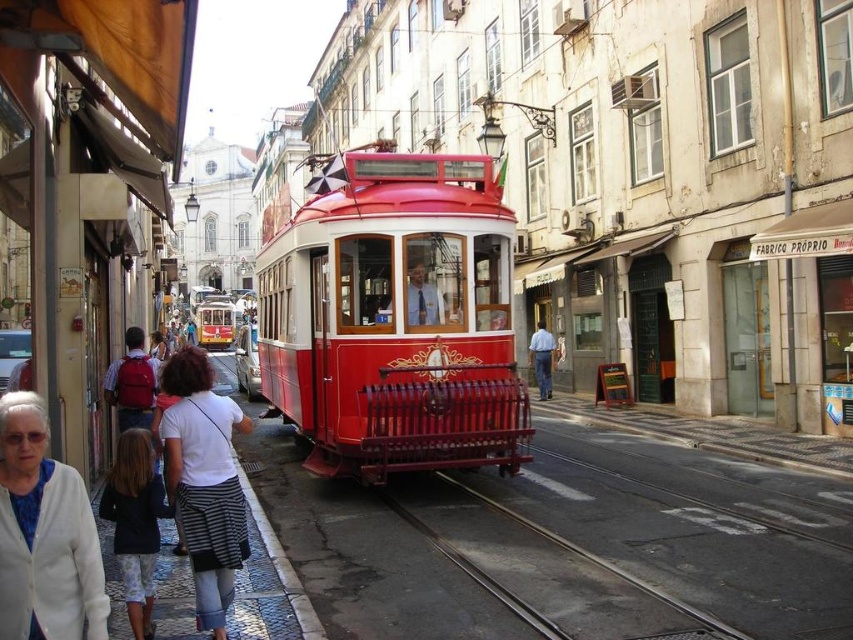
Can you confirm if shiny red tram at center is smaller than white fabric jacket at lower left?

No.

Is point (456, 276) behind point (59, 564)?

That is True.

Is point (343, 364) positioned behind point (32, 614)?

Yes, point (343, 364) is behind point (32, 614).

I want to click on shiny red tram at center, so click(x=393, y=317).

Does point (311, 376) come farther from viewer compared to point (132, 634)?

Yes, point (311, 376) is behind point (132, 634).

Is shiny red tram at center closer to camera compared to dark blue shirt at lower left?

That is False.

Between point (345, 211) and point (120, 481), which one is positioned in front?

Point (120, 481) is more forward.

You are a GUI agent. You are given a task and a screenshot of the screen. Output one action in this format:
    pyautogui.click(x=<x>, y=<y>)
    Task: Click on the shiny red tram at center
    
    Given the screenshot: What is the action you would take?
    pyautogui.click(x=393, y=317)

Consider the image. Can you confirm if red backpack at center is smaller than metallic gray track at center?

No, red backpack at center is not smaller than metallic gray track at center.

Can you confirm if red backpack at center is wider than metallic gray track at center?

Indeed, red backpack at center has a greater width compared to metallic gray track at center.

Which is in front, point (115, 403) or point (560, 540)?

Positioned in front is point (560, 540).

Find the location of a particular element. The width and height of the screenshot is (853, 640). red backpack at center is located at coordinates (132, 384).